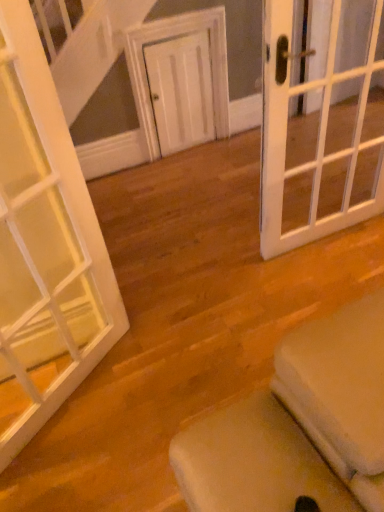
Question: Is white glass door at left, positioned as the third door in right-to-left order, positioned in front of white matte door at center, placed as the 2th door when sorted from left to right?

Choices:
 (A) yes
 (B) no

Answer: (A)

Question: Is white glass door at left, positioned as the third door in right-to-left order, located outside white matte door at center, placed as the 2th door when sorted from left to right?

Choices:
 (A) no
 (B) yes

Answer: (B)

Question: Are white glass door at left, which is counted as the third door, starting from the back, and white matte door at center, which is the third door from front to back, beside each other?

Choices:
 (A) yes
 (B) no

Answer: (B)

Question: From the image's perspective, is white glass door at left, which is counted as the 1th door, starting from the front, on white matte door at center, positioned as the 2th door in right-to-left order?

Choices:
 (A) yes
 (B) no

Answer: (B)

Question: From the image's perspective, is white glass door at left, positioned as the third door in right-to-left order, beneath white matte door at center, which is counted as the 1th door, starting from the back?

Choices:
 (A) no
 (B) yes

Answer: (B)

Question: Is white glass door at left, which is counted as the third door, starting from the back, oriented away from white matte door at center, positioned as the 2th door in right-to-left order?

Choices:
 (A) no
 (B) yes

Answer: (A)

Question: From a real-world perspective, is white glass door at right, positioned as the 2th door in front-to-back order, located beneath white glass door at left, which is counted as the third door, starting from the back?

Choices:
 (A) no
 (B) yes

Answer: (B)

Question: Is white glass door at right, positioned as the 2th door in front-to-back order, thinner than white glass door at left, arranged as the 1th door when viewed from the left?

Choices:
 (A) yes
 (B) no

Answer: (B)

Question: Is white glass door at right, which is the 1th door in right-to-left order, in contact with white glass door at left, positioned as the third door in right-to-left order?

Choices:
 (A) no
 (B) yes

Answer: (A)

Question: Would you consider white glass door at right, positioned as the 2th door in front-to-back order, to be distant from white glass door at left, which is counted as the 1th door, starting from the front?

Choices:
 (A) yes
 (B) no

Answer: (A)

Question: From the image's perspective, is white glass door at right, which is the third door from left to right, located beneath white glass door at left, positioned as the third door in right-to-left order?

Choices:
 (A) yes
 (B) no

Answer: (B)

Question: Is white glass door at right, which is the 1th door in right-to-left order, further to camera compared to white glass door at left, positioned as the third door in right-to-left order?

Choices:
 (A) yes
 (B) no

Answer: (A)

Question: Is the position of white matte door at center, positioned as the 2th door in right-to-left order, more distant than that of white glass door at left, which is counted as the third door, starting from the back?

Choices:
 (A) no
 (B) yes

Answer: (B)